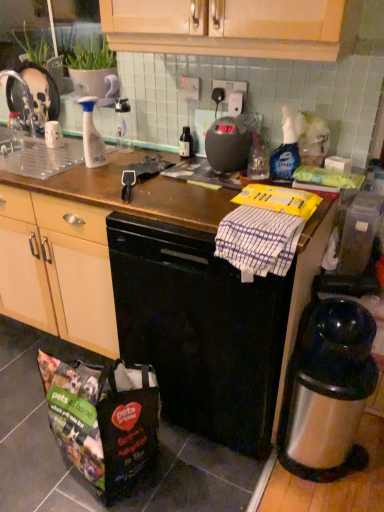
At what (x,y) coordinates should I click in order to perform the action: click on free location to the right of polyester shopping bag at lower left. Please return your answer as a coordinate pair (x, y). Looking at the image, I should click on (201, 468).